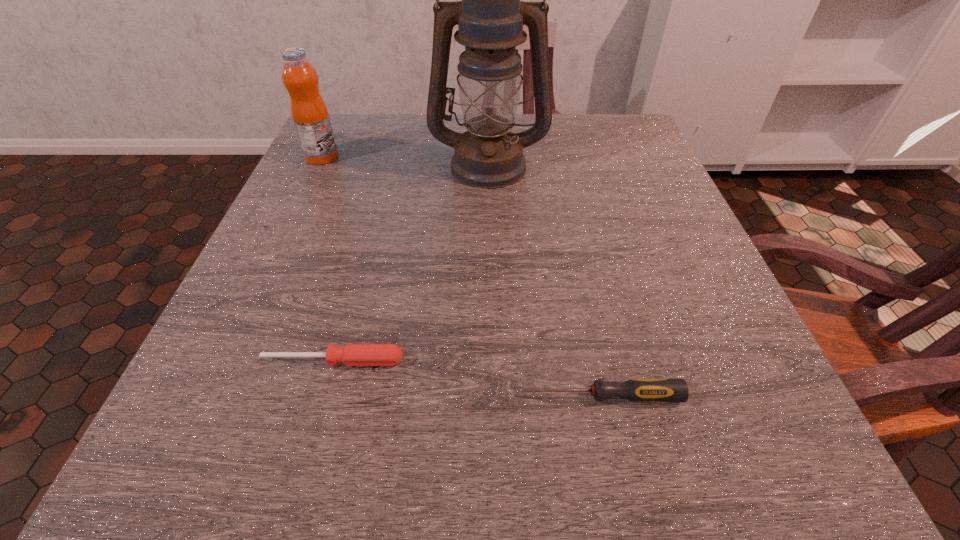
This screenshot has height=540, width=960. Find the location of `free point between the tallest object and the farther screwdriver`. free point between the tallest object and the farther screwdriver is located at coordinates (411, 262).

You are a GUI agent. You are given a task and a screenshot of the screen. Output one action in this format:
    pyautogui.click(x=<x>, y=<y>)
    Task: Click on the vacant area between the third farthest object and the fruit juice
    Image resolution: width=960 pixels, height=540 pixels.
    Given the screenshot: What is the action you would take?
    pyautogui.click(x=328, y=259)

The image size is (960, 540). Identify the location of free space that is in between the nearest object and the second nearest object. (467, 379).

I want to click on free area in between the nearer screwdriver and the fruit juice, so click(x=461, y=277).

What are the coordinates of `vacant space that is in between the tallest object and the right screwdriver` in the screenshot? It's located at (543, 280).

Identify the location of vacant space that's between the nearest object and the fruit juice. The height and width of the screenshot is (540, 960). (461, 277).

In order to click on free space between the farther screwdriver and the third shortest object in this screenshot , I will do [x=328, y=259].

Locate an element on the screen. The image size is (960, 540). the second closest object to the farther screwdriver is located at coordinates (490, 18).

At what (x,y) coordinates should I click in order to perform the action: click on the closest object to the farther screwdriver. Please return your answer as a coordinate pair (x, y). Looking at the image, I should click on (640, 390).

Locate an element on the screen. The height and width of the screenshot is (540, 960). free space that satisfies the following two spatial constraints: 1. on the back side of the farther screwdriver; 2. on the right side of the tallest object is located at coordinates (387, 165).